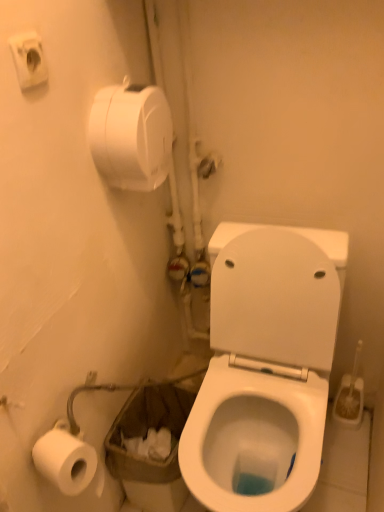
Question: Considering the relative sizes of white glossy toilet at center and white matte toilet paper at upper left in the image provided, is white glossy toilet at center thinner than white matte toilet paper at upper left?

Choices:
 (A) no
 (B) yes

Answer: (A)

Question: Can you confirm if white glossy toilet at center is positioned to the right of white matte toilet paper at upper left?

Choices:
 (A) yes
 (B) no

Answer: (A)

Question: Would you say white matte toilet paper at upper left is part of white glossy toilet at center's contents?

Choices:
 (A) no
 (B) yes

Answer: (A)

Question: Considering the relative sizes of white glossy toilet at center and white matte toilet paper at upper left in the image provided, is white glossy toilet at center shorter than white matte toilet paper at upper left?

Choices:
 (A) yes
 (B) no

Answer: (B)

Question: Would you say white glossy toilet at center is outside white matte toilet paper at upper left?

Choices:
 (A) yes
 (B) no

Answer: (A)

Question: Considering the relative positions of white plastic toilet brush at right and white glossy toilet at center in the image provided, is white plastic toilet brush at right to the left or to the right of white glossy toilet at center?

Choices:
 (A) right
 (B) left

Answer: (A)

Question: From their relative heights in the image, would you say white plastic toilet brush at right is taller or shorter than white glossy toilet at center?

Choices:
 (A) short
 (B) tall

Answer: (A)

Question: In terms of width, does white plastic toilet brush at right look wider or thinner when compared to white glossy toilet at center?

Choices:
 (A) thin
 (B) wide

Answer: (A)

Question: Is white plastic toilet brush at right inside or outside of white glossy toilet at center?

Choices:
 (A) outside
 (B) inside

Answer: (A)

Question: Considering their positions, is white matte toilet paper at upper left located in front of or behind white glossy toilet at center?

Choices:
 (A) behind
 (B) front

Answer: (A)

Question: Is white matte toilet paper at upper left to the left or to the right of white glossy toilet at center in the image?

Choices:
 (A) right
 (B) left

Answer: (B)

Question: Is white matte toilet paper at upper left inside the boundaries of white glossy toilet at center, or outside?

Choices:
 (A) outside
 (B) inside

Answer: (A)

Question: From the image's perspective, is white matte toilet paper at upper left above or below white glossy toilet at center?

Choices:
 (A) below
 (B) above

Answer: (B)

Question: Is point (347, 423) positioned closer to the camera than point (142, 135)?

Choices:
 (A) farther
 (B) closer

Answer: (A)

Question: In terms of width, does white plastic toilet brush at right look wider or thinner when compared to white matte toilet paper at upper left?

Choices:
 (A) thin
 (B) wide

Answer: (A)